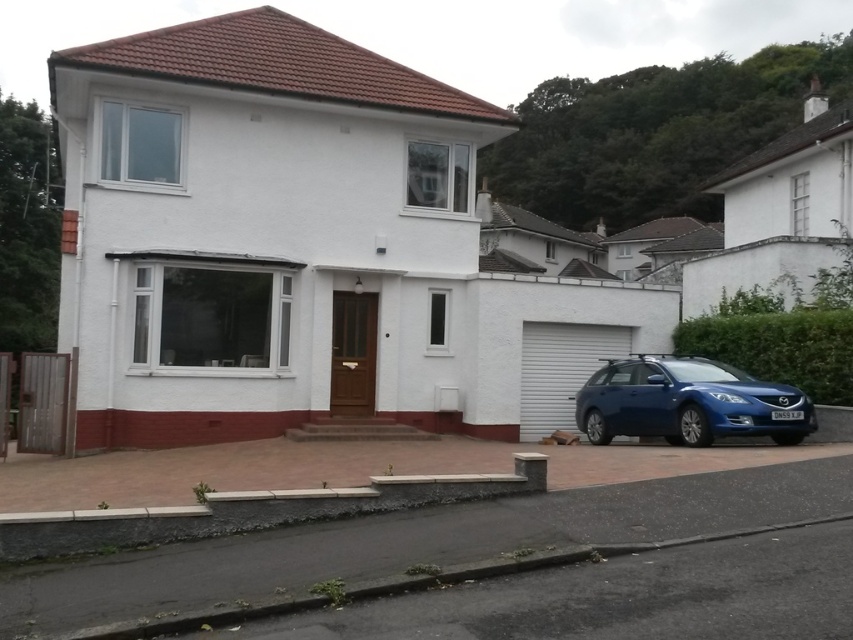
Which is above, brick paved driveway at lower center or paved concrete driveway at center?

brick paved driveway at lower center

Who is more distant from viewer, (554, 500) or (651, 458)?

Point (651, 458)

Is point (548, 532) positioned before point (49, 467)?

Yes.

Locate an element on the screen. Image resolution: width=853 pixels, height=640 pixels. brick paved driveway at lower center is located at coordinates (412, 541).

Which of these two, brick paved driveway at lower center or blue metallic car at lower right, stands taller?

blue metallic car at lower right is taller.

Does brick paved driveway at lower center appear on the left side of blue metallic car at lower right?

Yes, brick paved driveway at lower center is to the left of blue metallic car at lower right.

What do you see at coordinates (412, 541) in the screenshot? The image size is (853, 640). I see `brick paved driveway at lower center` at bounding box center [412, 541].

In order to click on brick paved driveway at lower center in this screenshot , I will do `click(412, 541)`.

Between paved concrete driveway at center and blue metallic car at lower right, which one is positioned lower?

paved concrete driveway at center is lower down.

Is paved concrete driveway at center bigger than blue metallic car at lower right?

Yes, paved concrete driveway at center is bigger than blue metallic car at lower right.

What do you see at coordinates (347, 467) in the screenshot? I see `paved concrete driveway at center` at bounding box center [347, 467].

This screenshot has width=853, height=640. In order to click on paved concrete driveway at center in this screenshot , I will do `click(347, 467)`.